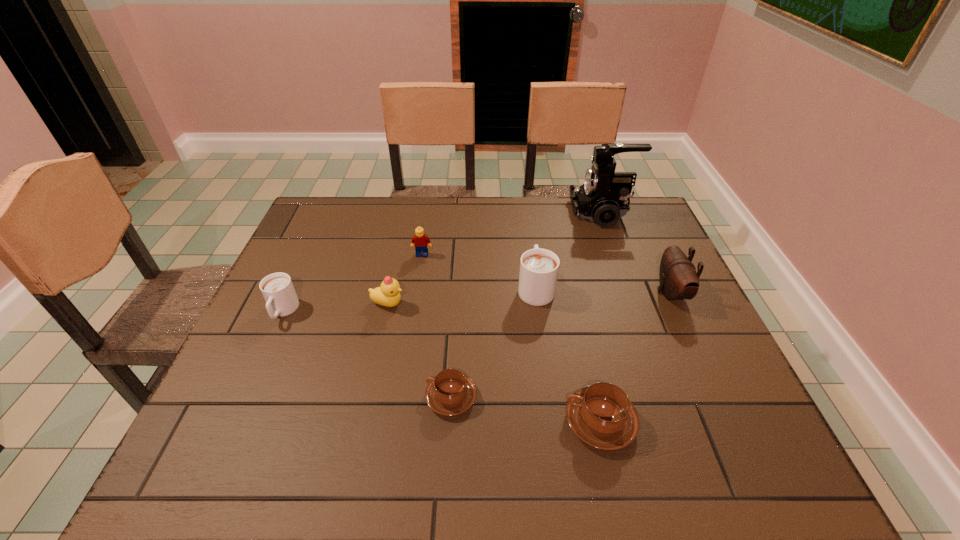
This screenshot has height=540, width=960. I want to click on the second shortest object, so point(601,415).

Find the location of a particular element. The width and height of the screenshot is (960, 540). the bigger brown cappuccino is located at coordinates coord(601,415).

Where is `the third cappuccino from right to left`? The image size is (960, 540). the third cappuccino from right to left is located at coordinates (450, 393).

Identify the location of the fourth object from left to right. This screenshot has height=540, width=960. (450, 393).

Find the location of a particular element. vacant space located 0.140m on the lens mount of the farthest object is located at coordinates (529, 213).

I want to click on blank area located 0.270m on the lens mount of the farthest object, so click(490, 213).

Where is `free space located 0.340m on the lens mount of the farthest object`? free space located 0.340m on the lens mount of the farthest object is located at coordinates (468, 213).

At what (x,y) coordinates should I click in order to perform the action: click on vacant space located 0.150m with the flap open on the brown pouch. Please return your answer as a coordinate pair (x, y). This screenshot has width=960, height=540. Looking at the image, I should click on [601, 293].

In order to click on free spot located 0.330m with the flap open on the brown pouch in this screenshot , I will do `click(533, 293)`.

The height and width of the screenshot is (540, 960). I want to click on vacant space situated 0.390m with the flap open on the brown pouch, so click(x=511, y=293).